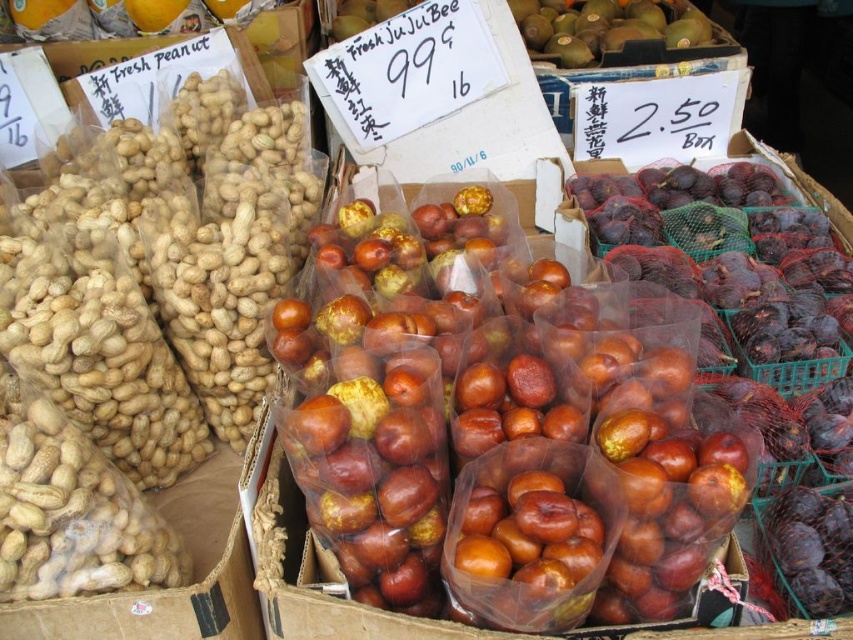
Question: Among these points, which one is farthest from the camera?

Choices:
 (A) (608, 316)
 (B) (608, 12)

Answer: (B)

Question: From the image, what is the correct spatial relationship of shiny brown apples at center in relation to green matte kiwi at upper center?

Choices:
 (A) right
 (B) left

Answer: (B)

Question: Is shiny brown apples at center smaller than green matte kiwi at upper center?

Choices:
 (A) no
 (B) yes

Answer: (B)

Question: Which point is closer to the camera taking this photo?

Choices:
 (A) (567, 20)
 (B) (720, 417)

Answer: (B)

Question: Is shiny brown apples at center bigger than green matte kiwi at upper center?

Choices:
 (A) no
 (B) yes

Answer: (A)